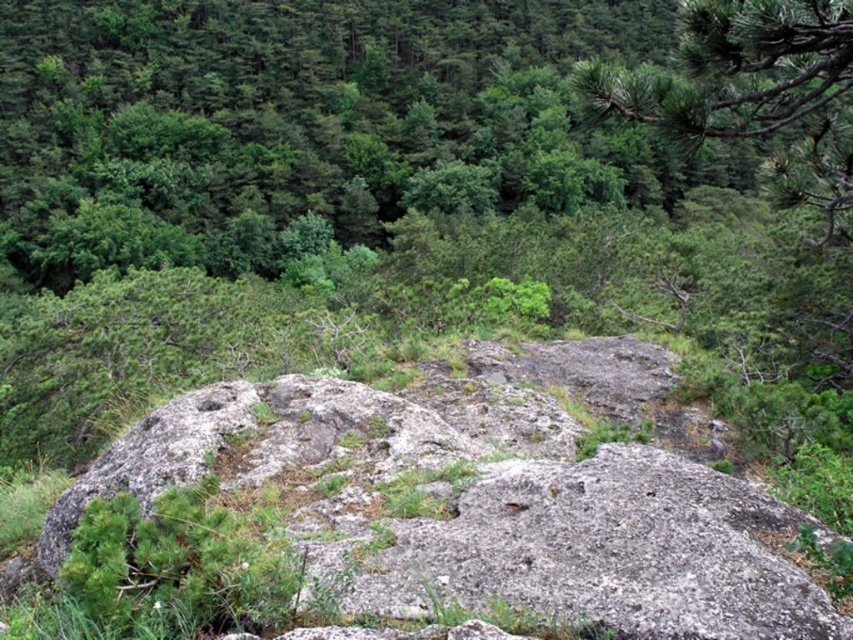
Does point (757, 493) come farther from viewer compared to point (833, 212)?

No, (757, 493) is closer to viewer.

Is gray rough rock at center behind green needle-like at upper right?

No, gray rough rock at center is closer to the viewer.

Who is more forward, (619,456) or (844,186)?

Positioned in front is point (619,456).

This screenshot has height=640, width=853. Identify the location of gray rough rock at center. (491, 493).